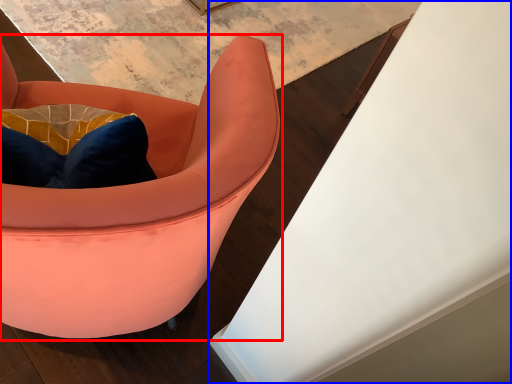
Question: Among these objects, which one is farthest to the camera, chair (highlighted by a red box) or table (highlighted by a blue box)?

Choices:
 (A) chair
 (B) table

Answer: (B)